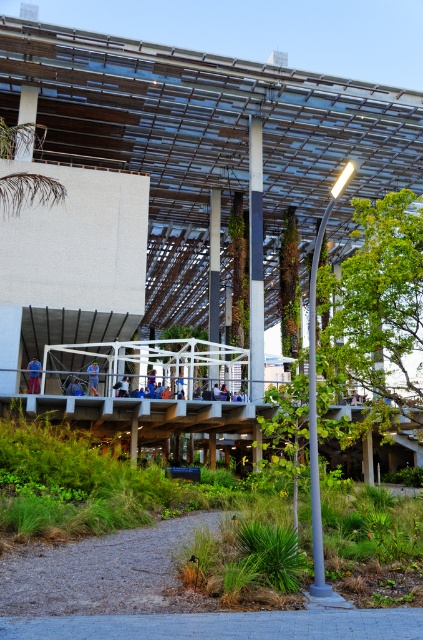
Can you confirm if gray concrete path at lower center is thinner than blue fabric person at center?

No, gray concrete path at lower center is not thinner than blue fabric person at center.

Is gray concrete path at lower center positioned at the back of blue fabric person at center?

No, gray concrete path at lower center is closer to the viewer.

The image size is (423, 640). I want to click on gray concrete path at lower center, so click(225, 625).

Can you confirm if green leafy tree at center is positioned above gray concrete path at lower center?

Indeed, green leafy tree at center is positioned over gray concrete path at lower center.

Is green leafy tree at center bigger than gray concrete path at lower center?

Indeed, green leafy tree at center has a larger size compared to gray concrete path at lower center.

Where is `green leafy tree at center`? The width and height of the screenshot is (423, 640). green leafy tree at center is located at coordinates (379, 307).

Does green leafy tree at center appear over blue denim jeans at lower left?

Correct, green leafy tree at center is located above blue denim jeans at lower left.

In the scene shown: Who is shorter, green leafy tree at center or blue denim jeans at lower left?

blue denim jeans at lower left

Which is in front, point (412, 298) or point (35, 371)?

Point (412, 298) is more forward.

The image size is (423, 640). In order to click on green leafy tree at center in this screenshot , I will do `click(379, 307)`.